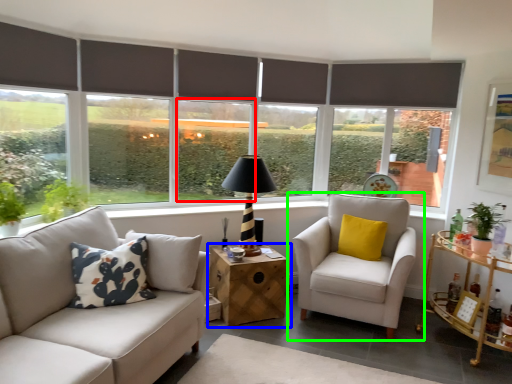
Question: Which is nearer to the window (highlighted by a red box)? table (highlighted by a blue box) or chair (highlighted by a green box).

Choices:
 (A) table
 (B) chair

Answer: (A)